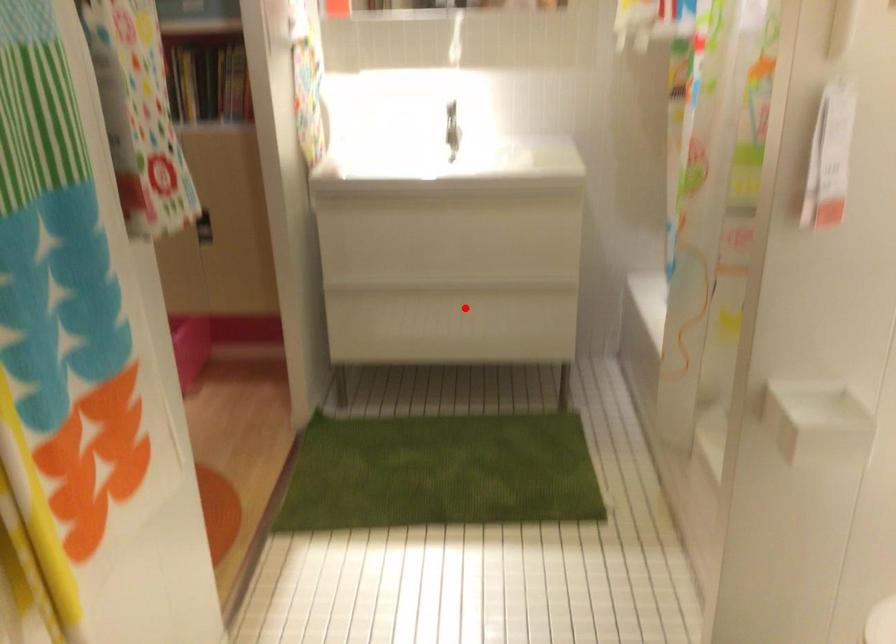
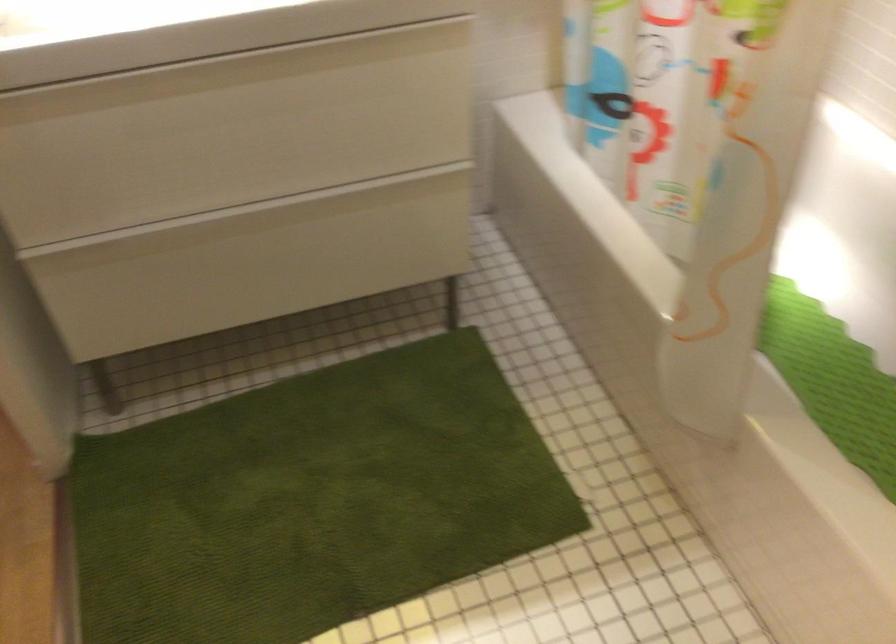
The point at the highlighted location is marked in the first image. Where is the corresponding point in the second image?

(289, 238)